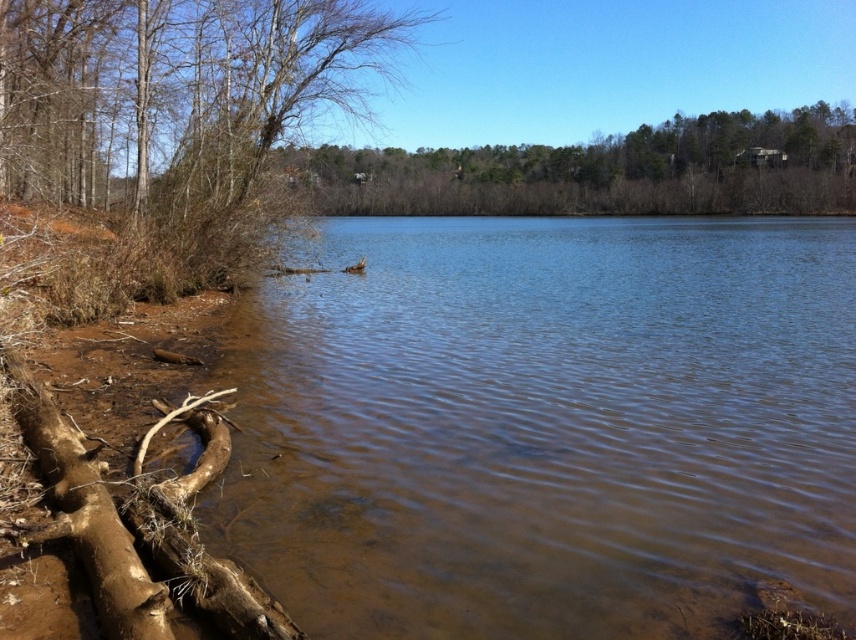
Question: Which object is positioned closest to the brown sediment water at lower left?

Choices:
 (A) brown bark tree at left
 (B) brown rough wood at lower left

Answer: (A)

Question: Which of the following is the farthest from the observer?

Choices:
 (A) (4, 365)
 (B) (155, 237)

Answer: (B)

Question: Estimate the real-world distances between objects in this image. Which object is farther from the brown sediment water at lower left?

Choices:
 (A) brown rough wood at lower left
 (B) brown bark tree at left

Answer: (A)

Question: Can you confirm if brown bark tree at left is positioned above brown rough wood at lower left?

Choices:
 (A) yes
 (B) no

Answer: (A)

Question: Is brown sediment water at lower left further to the viewer compared to brown bark tree at left?

Choices:
 (A) yes
 (B) no

Answer: (B)

Question: Can you confirm if brown sediment water at lower left is thinner than brown rough wood at lower left?

Choices:
 (A) yes
 (B) no

Answer: (B)